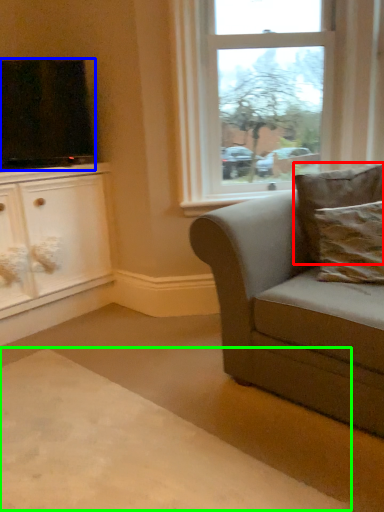
Question: Which is farther away from pillow (highlighted by a red box)? television (highlighted by a blue box) or plain (highlighted by a green box)?

Choices:
 (A) television
 (B) plain

Answer: (A)